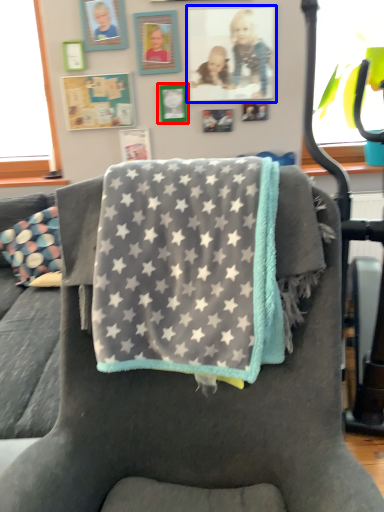
Question: Among these objects, which one is nearest to the camera, picture frame (highlighted by a red box) or picture frame (highlighted by a blue box)?

Choices:
 (A) picture frame
 (B) picture frame

Answer: (B)